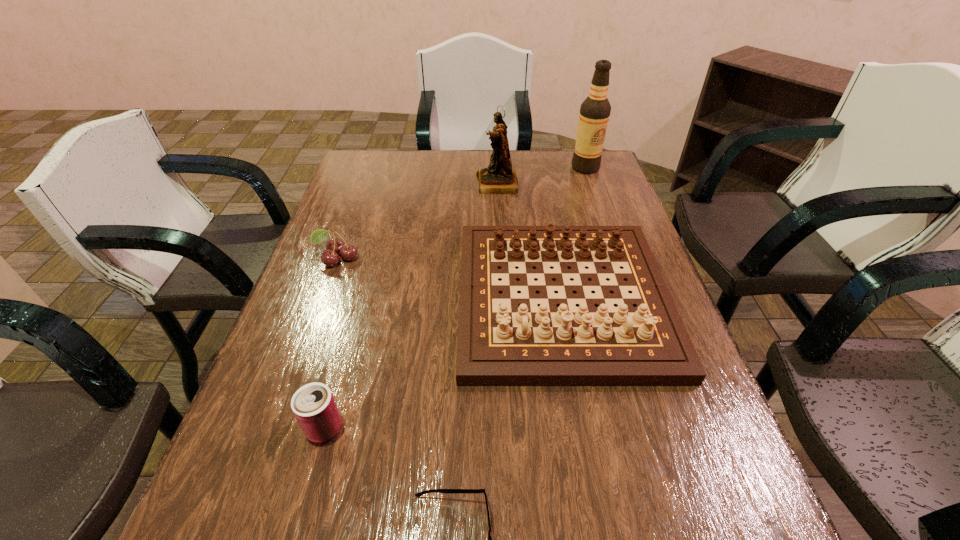
Where is `vacant space at the left edge`? This screenshot has height=540, width=960. vacant space at the left edge is located at coordinates (281, 421).

Find the location of a particular element. The width and height of the screenshot is (960, 540). vacant space at the far left corner of the desktop is located at coordinates (378, 166).

The width and height of the screenshot is (960, 540). Find the location of `vacant space that is in between the cherry and the can`. vacant space that is in between the cherry and the can is located at coordinates (331, 343).

The width and height of the screenshot is (960, 540). In order to click on free spot between the cherry and the second tallest object in this screenshot , I will do pos(418,221).

The image size is (960, 540). I want to click on vacant area between the gameboard and the second nearest object, so click(x=444, y=363).

Identify the location of vacant space that's between the cherry and the gameboard. 449,279.

Where is `free space between the can and the cherry`? This screenshot has width=960, height=540. free space between the can and the cherry is located at coordinates (331, 343).

Locate an element on the screen. The width and height of the screenshot is (960, 540). object that ranks as the third closest to the gameboard is located at coordinates (313, 405).

Identify which object is the fifth closest to the gameboard. Please provide its 2D coordinates. Your answer should be formatted as a tuple, i.e. [(x, y)], where the tuple contains the x and y coordinates of a point satisfying the conditions above.

[(594, 114)]

Locate an element on the screen. free space that satisfies the following two spatial constraints: 1. on the front-facing side of the second tallest object; 2. on the front side of the fifth farthest object is located at coordinates (510, 428).